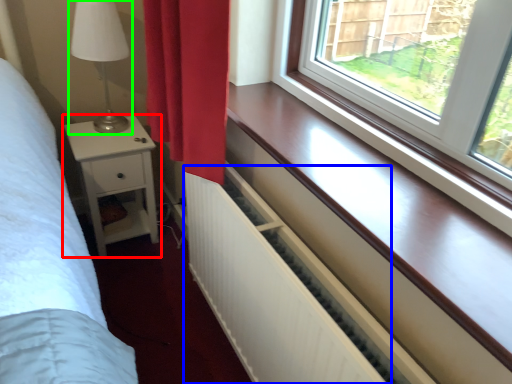
Question: Estimate the real-world distances between objects in this image. Which object is closer to nightstand (highlighted by a red box), radiator (highlighted by a blue box) or table lamp (highlighted by a green box)?

Choices:
 (A) radiator
 (B) table lamp

Answer: (B)